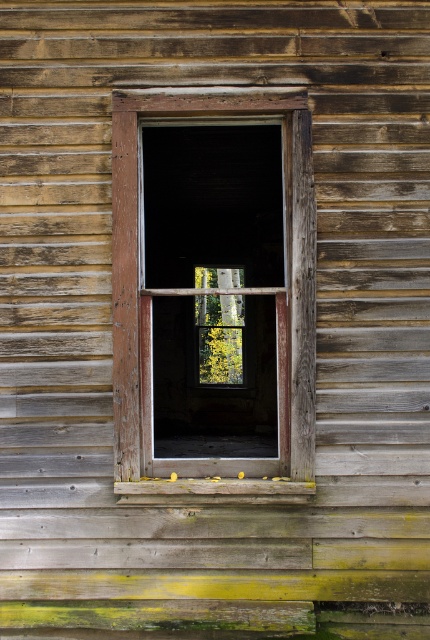
You are standing outside the weathered wooden building and want to check the distance to the weathered wood window frame at center. Can you estimate how far you are from it?

The distance between you and the weathered wood window frame at center is 16.01 feet.

You are standing outside the weathered wooden building. You want to locate the weathered wood window frame at center. Where should you look relative to the building?

The weathered wood window frame at center is located at the center of the building.